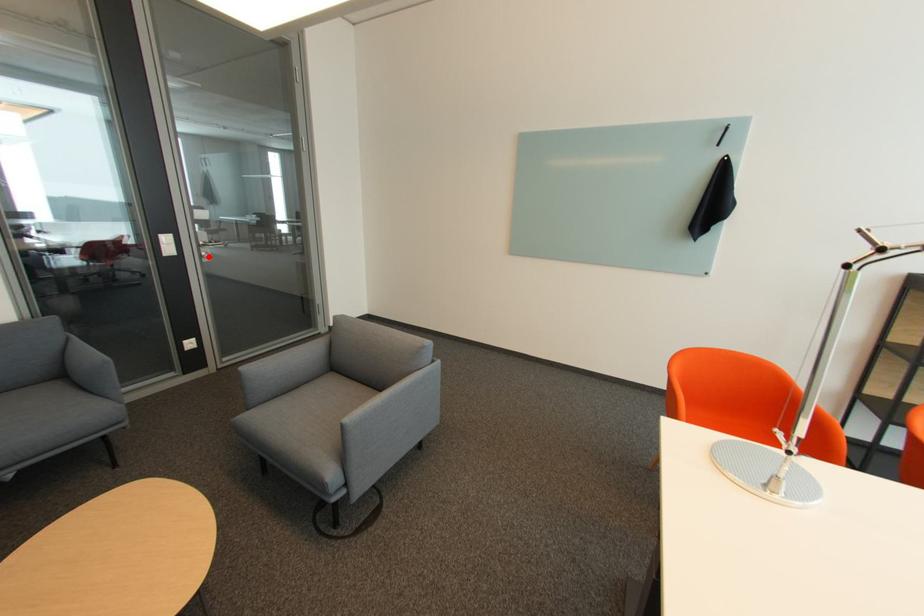
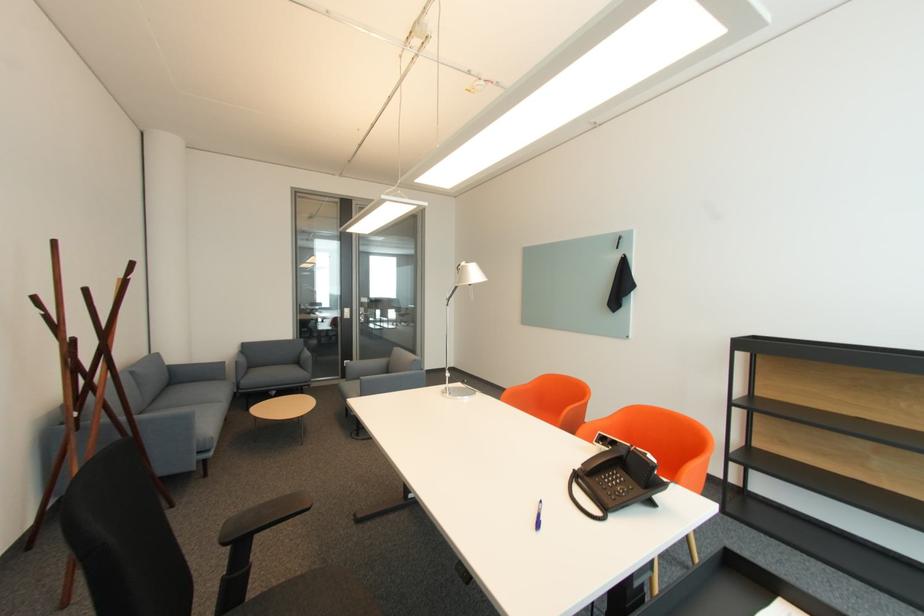
Question: I am providing you with two images of the same scene from different viewpoints. Image1 has a red point marked. In image2, the corresponding 3D location appears at what relative position? Reply with the corresponding letter.

Choices:
 (A) Closer
 (B) Farther

Answer: (A)